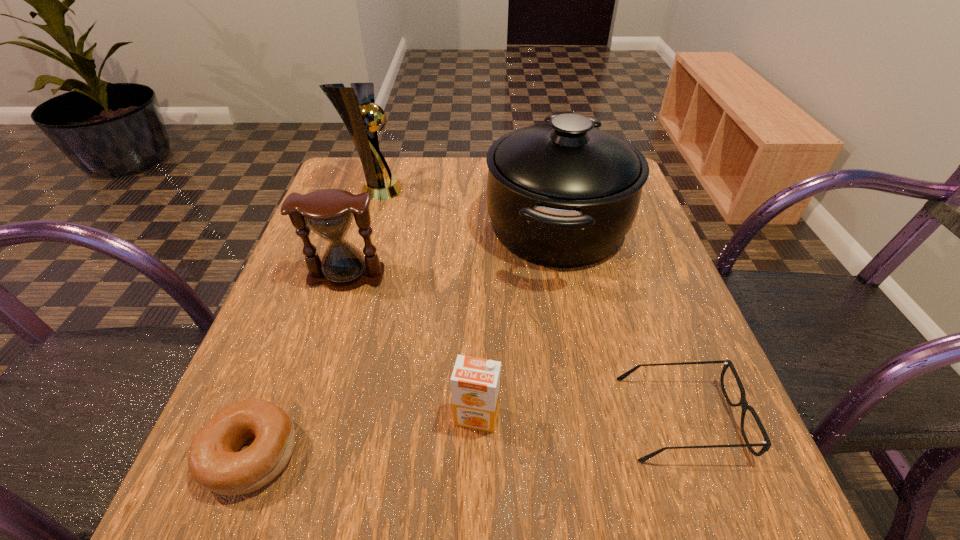
Image resolution: width=960 pixels, height=540 pixels. Identify the location of free region located on the back of the bagel. (316, 283).

You are a GUI agent. You are given a task and a screenshot of the screen. Output one action in this format:
    pyautogui.click(x=<x>, y=<y>)
    Task: Click on the free region located 0.150m with the lenses facing outward on the spectacles
    
    Given the screenshot: What is the action you would take?
    pyautogui.click(x=525, y=418)

The width and height of the screenshot is (960, 540). What are the coordinates of `vacant region located 0.090m with the lenses facing outward on the spectacles` in the screenshot? It's located at tap(565, 418).

Find the location of `free space located 0.140m with the lenses facing outward on the spectacles`. free space located 0.140m with the lenses facing outward on the spectacles is located at coordinates (532, 418).

Identify the location of award that is at the far edge. This screenshot has width=960, height=540. (356, 106).

Where is `saucepan that is at the far edge`? saucepan that is at the far edge is located at coordinates (563, 195).

Where is `bagel at the near edge`? This screenshot has height=540, width=960. bagel at the near edge is located at coordinates pos(214,462).

Where is `spectacles that is positioned at the near edge`? spectacles that is positioned at the near edge is located at coordinates (766, 444).

The width and height of the screenshot is (960, 540). Find the location of `award that is positioned at the left edge`. award that is positioned at the left edge is located at coordinates (356, 106).

The width and height of the screenshot is (960, 540). What are the coordinates of `hourglass situated at the left edge` in the screenshot? It's located at (329, 213).